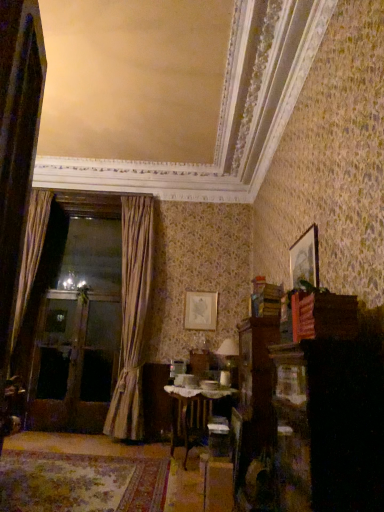
This screenshot has height=512, width=384. Find the location of `gold textured curtain at left, the first curtain positioned from the right`. gold textured curtain at left, the first curtain positioned from the right is located at coordinates pyautogui.click(x=132, y=317).

Find the location of a particular element. matte gold picture frame at center, which ranks as the first picture frame in left-to-right order is located at coordinates (200, 311).

Is matte gold picture frame at center, which ranks as the first picture frame in left-to-right order, far from wooden picture frame at upper right, which appears as the first picture frame when viewed from the top?

matte gold picture frame at center, which ranks as the first picture frame in left-to-right order, is positioned a significant distance from wooden picture frame at upper right, which appears as the first picture frame when viewed from the top.

Looking at this image, can wooden picture frame at upper right, positioned as the first picture frame in right-to-left order, be found inside matte gold picture frame at center, the second picture frame viewed from the right?

That's incorrect, wooden picture frame at upper right, positioned as the first picture frame in right-to-left order, is not inside matte gold picture frame at center, the second picture frame viewed from the right.

What's the angular difference between matte gold picture frame at center, the 2th picture frame from the top, and wooden picture frame at upper right, positioned as the first picture frame in right-to-left order,'s facing directions?

There is a 90.1-degree angle between the facing directions of matte gold picture frame at center, the 2th picture frame from the top, and wooden picture frame at upper right, positioned as the first picture frame in right-to-left order.

Which of these two, matte gold picture frame at center, which is counted as the first picture frame, starting from the bottom, or wooden picture frame at upper right, positioned as the first picture frame in right-to-left order, is bigger?

Bigger between the two is wooden picture frame at upper right, positioned as the first picture frame in right-to-left order.

Does wooden table at center appear on the left side of matte gold picture frame at center, the 2th picture frame from the top?

Yes.

Consider the image. Which object is closer to the camera, wooden table at center or matte gold picture frame at center, which appears as the 1th picture frame when viewed from the back?

wooden table at center is in front.

Can we say wooden table at center lies outside matte gold picture frame at center, which ranks as the first picture frame in left-to-right order?

Yes, wooden table at center is not within matte gold picture frame at center, which ranks as the first picture frame in left-to-right order.

Can you confirm if wooden table at center is smaller than matte gold picture frame at center, the second picture frame viewed from the right?

Incorrect, wooden table at center is not smaller in size than matte gold picture frame at center, the second picture frame viewed from the right.

Between matte gold picture frame at center, which appears as the 1th picture frame when viewed from the back, and wooden table at center, which one has larger size?

wooden table at center.

Could you tell me if matte gold picture frame at center, which is counted as the first picture frame, starting from the bottom, is facing wooden table at center?

No, matte gold picture frame at center, which is counted as the first picture frame, starting from the bottom, is not aimed at wooden table at center.

From a real-world perspective, between matte gold picture frame at center, which is counted as the first picture frame, starting from the bottom, and wooden table at center, who is vertically higher?

matte gold picture frame at center, which is counted as the first picture frame, starting from the bottom, from a real-world perspective.

Find the location of `curtain below the silky beige curtain at left, the 2th curtain in the right-to-left sequence (from the image's perspective)`. curtain below the silky beige curtain at left, the 2th curtain in the right-to-left sequence (from the image's perspective) is located at coordinates (132, 317).

From a real-world perspective, which object rests below the other?

From a 3D spatial view, gold textured curtain at left, the first curtain positioned from the right, is below.

Does silky beige curtain at left, marked as the 1th curtain in a left-to-right arrangement, have a lesser width compared to gold textured curtain at left, placed as the 2th curtain when sorted from left to right?

Indeed, silky beige curtain at left, marked as the 1th curtain in a left-to-right arrangement, has a lesser width compared to gold textured curtain at left, placed as the 2th curtain when sorted from left to right.

Would you say gold textured curtain at left, the first curtain positioned from the right, is part of silky beige curtain at left, marked as the 1th curtain in a left-to-right arrangement,'s contents?

No, gold textured curtain at left, the first curtain positioned from the right, is not surrounded by silky beige curtain at left, marked as the 1th curtain in a left-to-right arrangement.

Which object is thinner, gold textured curtain at left, the first curtain positioned from the right, or wooden picture frame at upper right, which appears as the first picture frame when viewed from the top?

With smaller width is wooden picture frame at upper right, which appears as the first picture frame when viewed from the top.

Is gold textured curtain at left, placed as the 2th curtain when sorted from left to right, next to wooden picture frame at upper right, the 2th picture frame viewed from the left, and touching it?

gold textured curtain at left, placed as the 2th curtain when sorted from left to right, and wooden picture frame at upper right, the 2th picture frame viewed from the left, are clearly separated.

Who is smaller, gold textured curtain at left, placed as the 2th curtain when sorted from left to right, or wooden picture frame at upper right, positioned as the first picture frame in right-to-left order?

wooden picture frame at upper right, positioned as the first picture frame in right-to-left order.

Does gold textured curtain at left, placed as the 2th curtain when sorted from left to right, have a greater height compared to wooden picture frame at upper right, which is the second picture frame in bottom-to-top order?

Correct, gold textured curtain at left, placed as the 2th curtain when sorted from left to right, is much taller as wooden picture frame at upper right, which is the second picture frame in bottom-to-top order.

From the image's perspective, which one is positioned lower, wooden picture frame at upper right, positioned as the first picture frame in right-to-left order, or wooden table at center?

wooden table at center appears lower in the image.

Which of these two, wooden picture frame at upper right, which appears as the first picture frame when viewed from the top, or wooden table at center, is bigger?

Bigger between the two is wooden table at center.

In terms of height, does wooden picture frame at upper right, positioned as the first picture frame in right-to-left order, look taller or shorter compared to wooden table at center?

Clearly, wooden picture frame at upper right, positioned as the first picture frame in right-to-left order, is shorter compared to wooden table at center.

Would you say wooden table at center is part of wooden picture frame at upper right, which appears as the first picture frame when viewed from the top,'s contents?

No.

Based on the photo, considering the positions of objects gold textured curtain at left, placed as the 2th curtain when sorted from left to right, and matte gold picture frame at center, which is counted as the first picture frame, starting from the bottom, in the image provided, who is more to the right, gold textured curtain at left, placed as the 2th curtain when sorted from left to right, or matte gold picture frame at center, which is counted as the first picture frame, starting from the bottom,?

From the viewer's perspective, matte gold picture frame at center, which is counted as the first picture frame, starting from the bottom, appears more on the right side.

Considering the relative sizes of gold textured curtain at left, the first curtain positioned from the right, and matte gold picture frame at center, which appears as the 1th picture frame when viewed from the back, in the image provided, is gold textured curtain at left, the first curtain positioned from the right, smaller than matte gold picture frame at center, which appears as the 1th picture frame when viewed from the back,?

Actually, gold textured curtain at left, the first curtain positioned from the right, might be larger than matte gold picture frame at center, which appears as the 1th picture frame when viewed from the back.

From a real-world perspective, is gold textured curtain at left, the first curtain positioned from the right, above or below matte gold picture frame at center, the second picture frame viewed from the right?

In terms of real-world spatial position, gold textured curtain at left, the first curtain positioned from the right, is below matte gold picture frame at center, the second picture frame viewed from the right.

You are a GUI agent. You are given a task and a screenshot of the screen. Output one action in this format:
    pyautogui.click(x=<x>, y=<y>)
    Task: Click on the picture frame on the right of matte gold picture frame at center, marked as the second picture frame in a front-to-back arrangement
    The width and height of the screenshot is (384, 512).
    Given the screenshot: What is the action you would take?
    pyautogui.click(x=305, y=259)

Image resolution: width=384 pixels, height=512 pixels. I want to click on picture frame that is the 1st one when counting upward from the wooden table at center (from the image's perspective), so click(x=200, y=311).

From the image, which object appears to be nearer to wooden table at center, silky beige curtain at left, marked as the 1th curtain in a left-to-right arrangement, or matte gold picture frame at center, the 2th picture frame from the top?

matte gold picture frame at center, the 2th picture frame from the top, is closer to wooden table at center.

In the scene shown: Looking at the image, which one is located further to wooden picture frame at upper right, which is the first picture frame from front to back, gold textured curtain at left, the first curtain positioned from the right, or wooden table at center?

gold textured curtain at left, the first curtain positioned from the right, lies further to wooden picture frame at upper right, which is the first picture frame from front to back, than the other object.

Based on the photo, considering their positions, is gold textured curtain at left, the first curtain positioned from the right, positioned further to matte gold picture frame at center, the second picture frame viewed from the right, than silky beige curtain at left, marked as the 1th curtain in a left-to-right arrangement?

silky beige curtain at left, marked as the 1th curtain in a left-to-right arrangement.

Estimate the real-world distances between objects in this image. Which object is further from wooden picture frame at upper right, which is the first picture frame from front to back, matte gold picture frame at center, which is counted as the first picture frame, starting from the bottom, or silky beige curtain at left, marked as the 1th curtain in a left-to-right arrangement?

The object further to wooden picture frame at upper right, which is the first picture frame from front to back, is silky beige curtain at left, marked as the 1th curtain in a left-to-right arrangement.

Based on their spatial positions, is wooden table at center or wooden picture frame at upper right, positioned as the first picture frame in right-to-left order, further from matte gold picture frame at center, which appears as the 1th picture frame when viewed from the back?

wooden picture frame at upper right, positioned as the first picture frame in right-to-left order.

Considering their positions, is gold textured curtain at left, the first curtain positioned from the right, positioned closer to silky beige curtain at left, the 2th curtain in the right-to-left sequence, than wooden picture frame at upper right, the 2th picture frame viewed from the left?

The object closer to silky beige curtain at left, the 2th curtain in the right-to-left sequence, is gold textured curtain at left, the first curtain positioned from the right.

Estimate the real-world distances between objects in this image. Which object is closer to silky beige curtain at left, the 2th curtain in the right-to-left sequence, matte gold picture frame at center, the second picture frame viewed from the right, or wooden table at center?

matte gold picture frame at center, the second picture frame viewed from the right, lies closer to silky beige curtain at left, the 2th curtain in the right-to-left sequence, than the other object.

Which object lies further to the anchor point matte gold picture frame at center, marked as the second picture frame in a front-to-back arrangement, wooden picture frame at upper right, which appears as the first picture frame when viewed from the top, or silky beige curtain at left, the 2th curtain in the right-to-left sequence?

Among the two, wooden picture frame at upper right, which appears as the first picture frame when viewed from the top, is located further to matte gold picture frame at center, marked as the second picture frame in a front-to-back arrangement.

This screenshot has width=384, height=512. I want to click on table between wooden picture frame at upper right, which ranks as the second picture frame in back-to-front order, and matte gold picture frame at center, the second picture frame viewed from the right, along the z-axis, so click(192, 414).

Locate an element on the screen. This screenshot has width=384, height=512. table between silky beige curtain at left, marked as the 1th curtain in a left-to-right arrangement, and wooden picture frame at upper right, which is the first picture frame from front to back is located at coordinates pyautogui.click(x=192, y=414).

What are the coordinates of `curtain situated between silky beige curtain at left, the 2th curtain in the right-to-left sequence, and wooden table at center from left to right` in the screenshot? It's located at (132, 317).

At what (x,y) coordinates should I click in order to perform the action: click on curtain situated between silky beige curtain at left, the 2th curtain in the right-to-left sequence, and wooden picture frame at upper right, the 2th picture frame viewed from the left, from left to right. Please return your answer as a coordinate pair (x, y). Looking at the image, I should click on (132, 317).